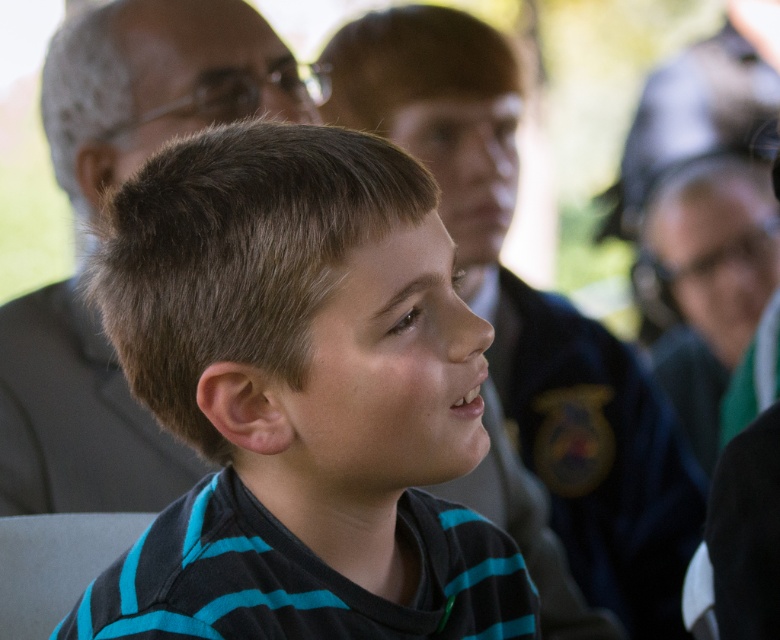
Does striped cotton shirt at center have a smaller size compared to dark gray suit at upper left?

Yes, striped cotton shirt at center is smaller than dark gray suit at upper left.

Does striped cotton shirt at center appear on the left side of dark gray suit at upper left?

No, striped cotton shirt at center is not to the left of dark gray suit at upper left.

Does point (167, 157) come farther from viewer compared to point (115, 160)?

No, it is not.

Locate an element on the screen. Image resolution: width=780 pixels, height=640 pixels. striped cotton shirt at center is located at coordinates (300, 397).

Does blue striped shirt at center appear on the right side of dark gray suit at upper left?

Yes, blue striped shirt at center is to the right of dark gray suit at upper left.

Is blue striped shirt at center bigger than dark gray suit at upper left?

Yes, blue striped shirt at center is bigger than dark gray suit at upper left.

Does point (539, 385) lie behind point (16, 348)?

Yes, it is behind point (16, 348).

Find the location of a particular element. Image resolution: width=780 pixels, height=640 pixels. blue striped shirt at center is located at coordinates (532, 314).

Is striped cotton shirt at center in front of blue striped shirt at center?

That is True.

Between striped cotton shirt at center and blue striped shirt at center, which one has more height?

With more height is blue striped shirt at center.

Is point (133, 260) positioned behind point (465, 67)?

No, (133, 260) is closer to viewer.

At what (x,y) coordinates should I click in order to perform the action: click on striped cotton shirt at center. Please return your answer as a coordinate pair (x, y). Looking at the image, I should click on (300, 397).